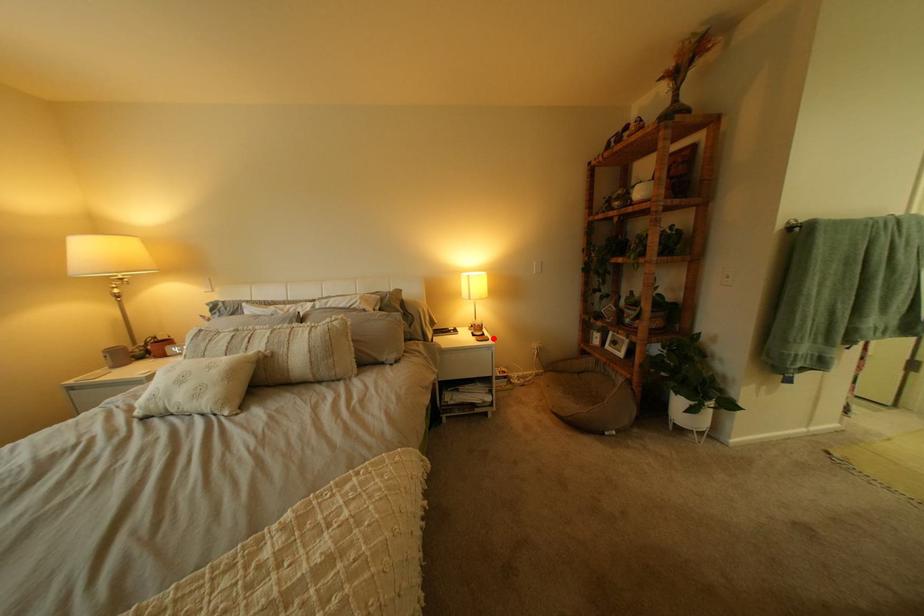
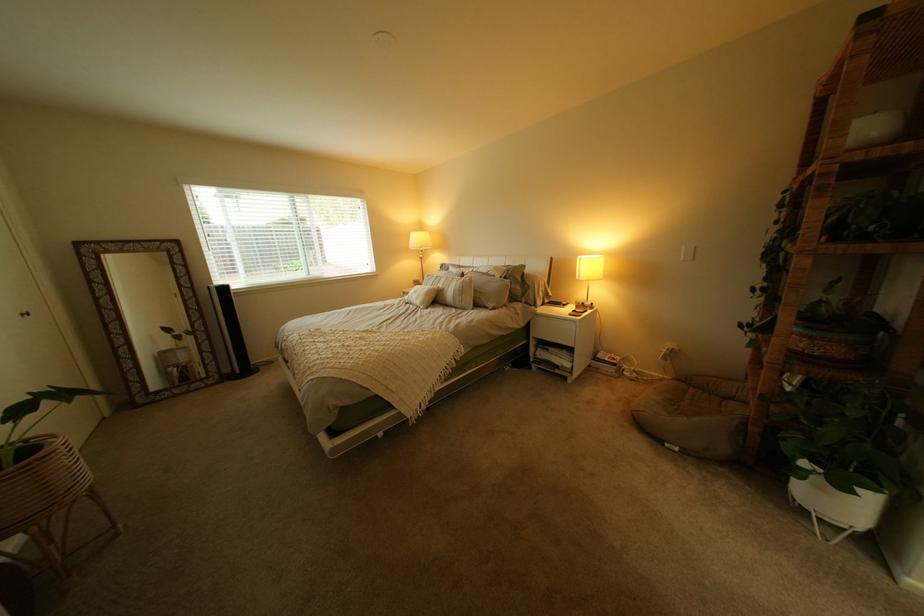
The point at the highlighted location is marked in the first image. Where is the corresponding point in the second image?

(590, 314)